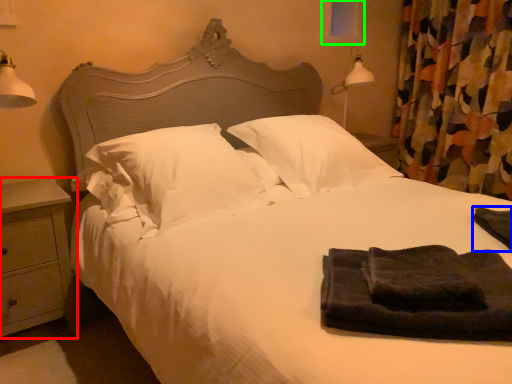
Question: Which object is positioned farthest from nightstand (highlighted by a red box)? Select from material (highlighted by a blue box) and window screen (highlighted by a green box).

Choices:
 (A) material
 (B) window screen

Answer: (B)